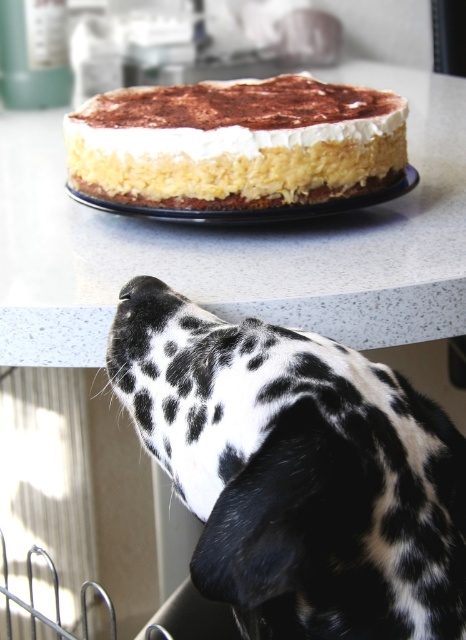
Question: Estimate the real-world distances between objects in this image. Which object is farther from the black and white spotted fur at upper center?

Choices:
 (A) yellow sponge cake at center
 (B) white speckled table at center
 (C) white creamy cake at center

Answer: (A)

Question: Can you confirm if black and white spotted fur at upper center is positioned to the left of white speckled table at center?

Choices:
 (A) yes
 (B) no

Answer: (B)

Question: Observing the image, what is the correct spatial positioning of black and white spotted fur at upper center in reference to white speckled table at center?

Choices:
 (A) above
 (B) below

Answer: (B)

Question: Does white speckled table at center have a lesser width compared to yellow sponge cake at center?

Choices:
 (A) yes
 (B) no

Answer: (B)

Question: Among these objects, which one is farthest from the camera?

Choices:
 (A) yellow sponge cake at center
 (B) white creamy cake at center

Answer: (A)

Question: Which object is positioned farthest from the black and white spotted fur at upper center?

Choices:
 (A) white creamy cake at center
 (B) white speckled table at center

Answer: (A)